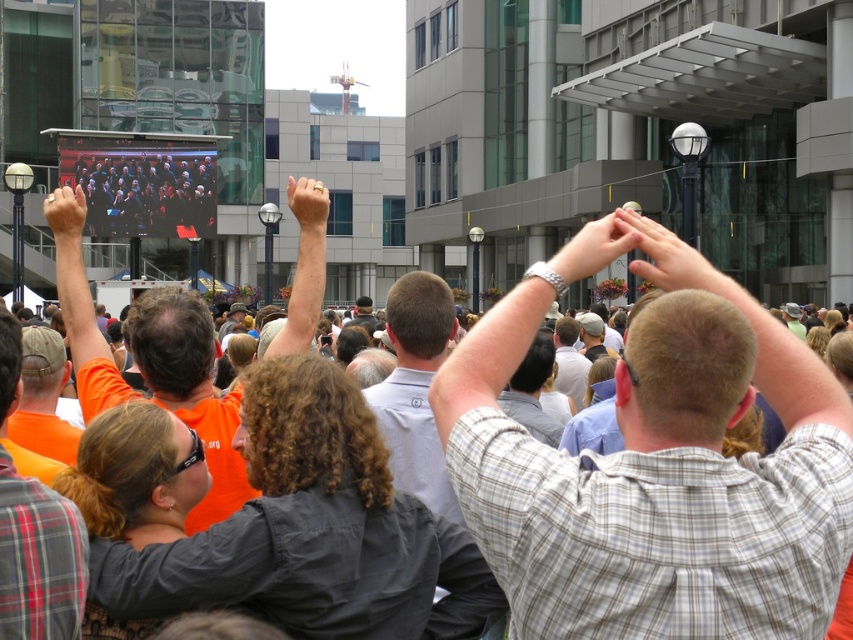
Looking at this image, is orange t-shirt at upper left wider than orange fabric arm at upper left?

No, orange t-shirt at upper left is not wider than orange fabric arm at upper left.

Does orange t-shirt at upper left have a smaller size compared to orange fabric arm at upper left?

Yes, orange t-shirt at upper left is smaller than orange fabric arm at upper left.

Is point (45, 593) farther from camera compared to point (79, 310)?

No.

The width and height of the screenshot is (853, 640). Find the location of `orange t-shirt at upper left`. orange t-shirt at upper left is located at coordinates (38, 560).

Measure the distance between point (61, 291) and camera.

A distance of 27.12 meters exists between point (61, 291) and camera.

Based on the photo, who is lower down, orange fabric arm at upper left or matte gold ring at upper center?

orange fabric arm at upper left is lower down.

What do you see at coordinates (76, 282) in the screenshot?
I see `orange fabric arm at upper left` at bounding box center [76, 282].

Identify the location of orange fabric arm at upper left. The image size is (853, 640). (76, 282).

Does gray cotton shirt at center have a lesser height compared to smooth skin hands at upper right?

Incorrect, gray cotton shirt at center's height does not fall short of smooth skin hands at upper right's.

Image resolution: width=853 pixels, height=640 pixels. What are the coordinates of `gray cotton shirt at center` in the screenshot? It's located at (416, 388).